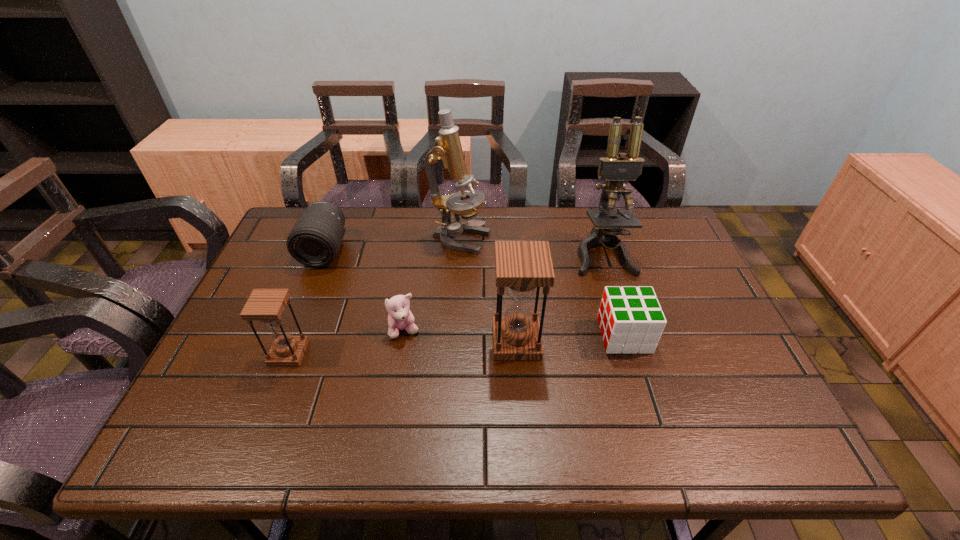
The hourglasss are evenly distributed in the image. To maintain this, where would you place another hourglass on the right? Please point to a free space. Please provide its 2D coordinates. Your answer should be formatted as a tuple, i.e. [(x, y)], where the tuple contains the x and y coordinates of a point satisfying the conditions above.

[(733, 330)]